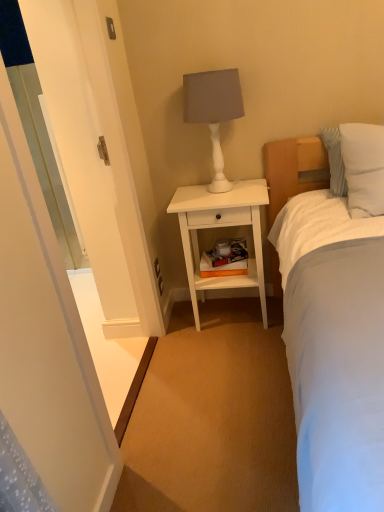
Question: Is white glossy screen door at left at the right side of white matte table lamp at upper center?

Choices:
 (A) yes
 (B) no

Answer: (B)

Question: Are white glossy screen door at left and white matte table lamp at upper center far apart?

Choices:
 (A) no
 (B) yes

Answer: (B)

Question: From the image's perspective, is white glossy screen door at left under white matte table lamp at upper center?

Choices:
 (A) yes
 (B) no

Answer: (A)

Question: From the image's perspective, is white glossy screen door at left on white matte table lamp at upper center?

Choices:
 (A) no
 (B) yes

Answer: (A)

Question: Can you confirm if white glossy screen door at left is shorter than white matte table lamp at upper center?

Choices:
 (A) no
 (B) yes

Answer: (A)

Question: Could you tell me if white glossy screen door at left is turned towards white matte table lamp at upper center?

Choices:
 (A) yes
 (B) no

Answer: (B)

Question: Considering the relative sizes of white soft pillow at upper right and white matte nightstand at center in the image provided, is white soft pillow at upper right wider than white matte nightstand at center?

Choices:
 (A) no
 (B) yes

Answer: (A)

Question: Are white soft pillow at upper right and white matte nightstand at center far apart?

Choices:
 (A) yes
 (B) no

Answer: (B)

Question: From a real-world perspective, is white soft pillow at upper right physically above white matte nightstand at center?

Choices:
 (A) yes
 (B) no

Answer: (A)

Question: From the image's perspective, is white soft pillow at upper right located beneath white matte nightstand at center?

Choices:
 (A) no
 (B) yes

Answer: (A)

Question: Is white matte nightstand at center inside white soft pillow at upper right?

Choices:
 (A) yes
 (B) no

Answer: (B)

Question: Are white soft pillow at upper right and white matte nightstand at center making contact?

Choices:
 (A) no
 (B) yes

Answer: (A)

Question: From the image's perspective, is white matte nightstand at center on white glossy screen door at left?

Choices:
 (A) no
 (B) yes

Answer: (A)